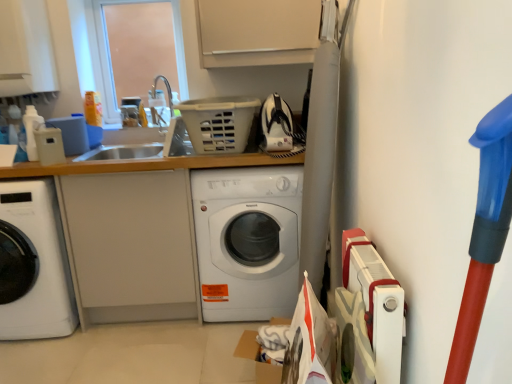
Question: Considering the relative sizes of white glossy washing machine at center, which ranks as the 2th washing machine in left-to-right order, and white matte counter top at center in the image provided, is white glossy washing machine at center, which ranks as the 2th washing machine in left-to-right order, smaller than white matte counter top at center?

Choices:
 (A) yes
 (B) no

Answer: (A)

Question: Is white glossy washing machine at center, marked as the 1th washing machine in a right-to-left arrangement, to the left of white matte counter top at center from the viewer's perspective?

Choices:
 (A) yes
 (B) no

Answer: (B)

Question: Can you confirm if white glossy washing machine at center, which ranks as the 2th washing machine in left-to-right order, is shorter than white matte counter top at center?

Choices:
 (A) no
 (B) yes

Answer: (B)

Question: Does white glossy washing machine at center, marked as the 1th washing machine in a right-to-left arrangement, come behind white matte counter top at center?

Choices:
 (A) no
 (B) yes

Answer: (B)

Question: Is white glossy washing machine at center, marked as the 1th washing machine in a right-to-left arrangement, not within white matte counter top at center?

Choices:
 (A) no
 (B) yes

Answer: (A)

Question: Would you say white glossy washing machine at center, which ranks as the 2th washing machine in left-to-right order, is to the left or to the right of white glossy washing machine at left, acting as the second washing machine starting from the right, in the picture?

Choices:
 (A) left
 (B) right

Answer: (B)

Question: Considering their positions, is white glossy washing machine at center, which ranks as the 2th washing machine in left-to-right order, located in front of or behind white glossy washing machine at left, acting as the second washing machine starting from the right?

Choices:
 (A) behind
 (B) front

Answer: (A)

Question: Considering the positions of white glossy washing machine at center, which ranks as the 2th washing machine in left-to-right order, and white glossy washing machine at left, acting as the second washing machine starting from the right, in the image, is white glossy washing machine at center, which ranks as the 2th washing machine in left-to-right order, taller or shorter than white glossy washing machine at left, acting as the second washing machine starting from the right,?

Choices:
 (A) short
 (B) tall

Answer: (B)

Question: Considering the positions of point (238, 273) and point (46, 326), is point (238, 273) closer or farther from the camera than point (46, 326)?

Choices:
 (A) closer
 (B) farther

Answer: (A)

Question: Is transparent plastic window screen at upper left bigger or smaller than white matte counter top at center?

Choices:
 (A) small
 (B) big

Answer: (A)

Question: From their relative heights in the image, would you say transparent plastic window screen at upper left is taller or shorter than white matte counter top at center?

Choices:
 (A) tall
 (B) short

Answer: (B)

Question: Does point (182, 48) appear closer or farther from the camera than point (175, 183)?

Choices:
 (A) closer
 (B) farther

Answer: (B)

Question: Considering their positions, is transparent plastic window screen at upper left located in front of or behind white matte counter top at center?

Choices:
 (A) behind
 (B) front

Answer: (A)

Question: Considering the positions of white glossy washing machine at center, which ranks as the 2th washing machine in left-to-right order, and white matte counter top at center in the image, is white glossy washing machine at center, which ranks as the 2th washing machine in left-to-right order, wider or thinner than white matte counter top at center?

Choices:
 (A) wide
 (B) thin

Answer: (A)

Question: In the image, is white glossy washing machine at center, marked as the 1th washing machine in a right-to-left arrangement, on the left side or the right side of white matte counter top at center?

Choices:
 (A) left
 (B) right

Answer: (B)